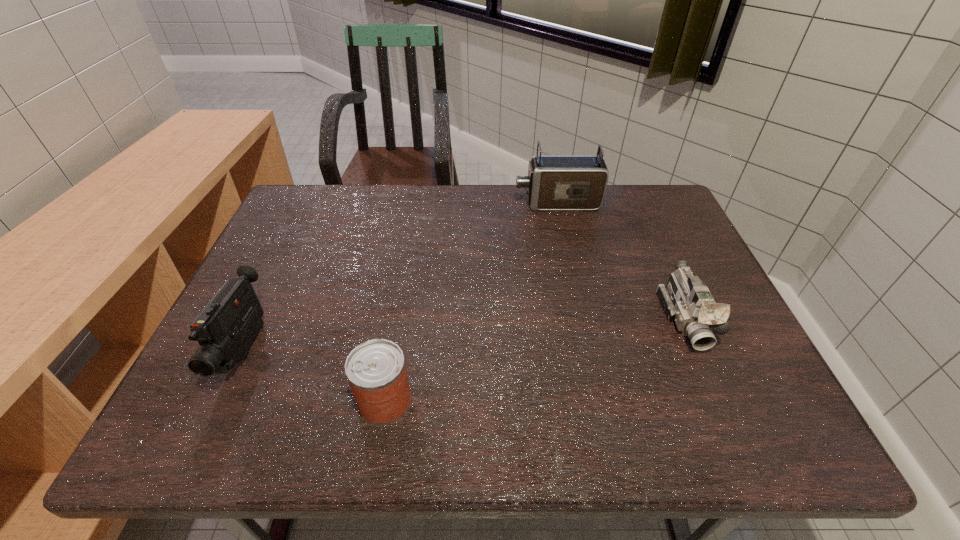
Identify the location of the farthest object. (554, 182).

Image resolution: width=960 pixels, height=540 pixels. Identify the location of the farthest camcorder. (554, 182).

Where is `the second tallest camcorder`? The image size is (960, 540). the second tallest camcorder is located at coordinates (226, 327).

At what (x,y) coordinates should I click in order to perform the action: click on the third shortest object. Please return your answer as a coordinate pair (x, y). The height and width of the screenshot is (540, 960). Looking at the image, I should click on (226, 327).

This screenshot has height=540, width=960. Find the location of `the shortest camcorder`. the shortest camcorder is located at coordinates (686, 300).

Locate an element on the screen. the rightmost object is located at coordinates (686, 300).

This screenshot has height=540, width=960. What are the coordinates of `the third object from right to left` in the screenshot? It's located at (376, 371).

Image resolution: width=960 pixels, height=540 pixels. I want to click on vacant point located 0.280m at the lens of the tallest camcorder, so click(x=425, y=203).

At what (x,y) coordinates should I click in order to perform the action: click on free space located 0.290m at the lens of the tallest camcorder. Please return your answer as a coordinate pair (x, y). Looking at the image, I should click on (421, 203).

The height and width of the screenshot is (540, 960). I want to click on free space located at the lens of the tallest camcorder, so click(x=399, y=203).